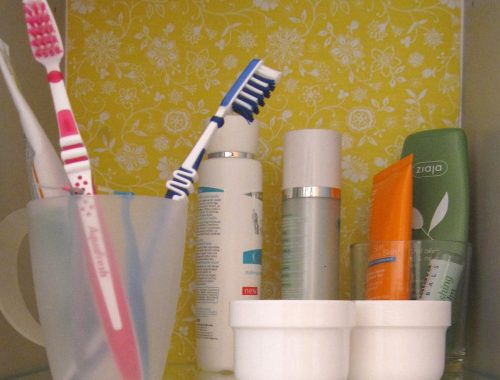
Identify the location of 2 toothbrushes. The width and height of the screenshot is (500, 380). (72, 168), (179, 178).